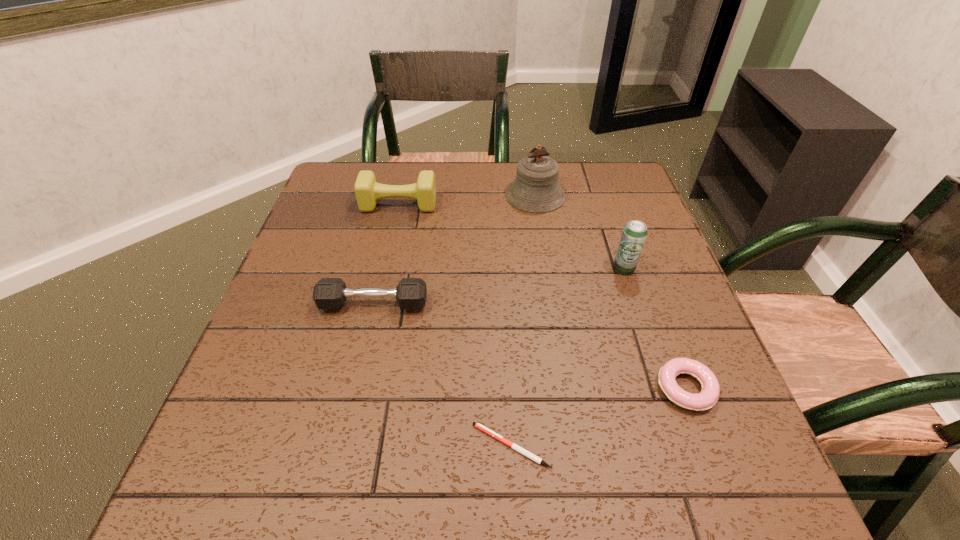
I want to click on dumbbell at the far edge, so click(367, 190).

The width and height of the screenshot is (960, 540). What are the coordinates of `object that is positioned at the near edge` in the screenshot? It's located at point(521,450).

At what (x,y) coordinates should I click in order to perform the action: click on beer can positioned at the right edge. Please return your answer as a coordinate pair (x, y). Looking at the image, I should click on (634, 234).

Where is `doughnut located in the right edge section of the desktop`? doughnut located in the right edge section of the desktop is located at coordinates (707, 398).

The image size is (960, 540). Identify the location of object at the far left corner. (367, 190).

In the image, there is a desktop. At what (x,y) coordinates should I click in order to perform the action: click on vacant space at the far edge. Please return your answer as a coordinate pair (x, y). Looking at the image, I should click on (466, 197).

Identify the location of vacant space at the near edge of the desktop. The image size is (960, 540). (548, 478).

The height and width of the screenshot is (540, 960). In the image, there is a desktop. What are the coordinates of `free space at the left edge` in the screenshot? It's located at (316, 333).

This screenshot has height=540, width=960. What are the coordinates of `vacant area at the right edge of the desktop` in the screenshot? It's located at (595, 227).

I want to click on blank space at the far right corner of the desktop, so click(616, 196).